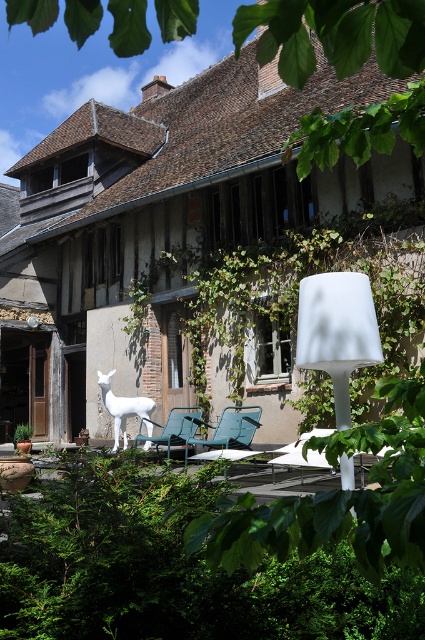
Question: Does white matte lamp at center appear under teal fabric chair at center?

Choices:
 (A) yes
 (B) no

Answer: (B)

Question: Which object is positioned farthest from the metallic blue chair at center?

Choices:
 (A) teal fabric chair at center
 (B) green leafy bush at lower left
 (C) white matte lamp at center
 (D) white glossy statue at center

Answer: (C)

Question: Which object is closer to the camera taking this photo?

Choices:
 (A) green leafy bush at lower left
 (B) white glossy statue at center
 (C) metallic blue chair at center
 (D) white matte lamp at center

Answer: (A)

Question: Is green leafy bush at lower left to the right of white matte lamp at center from the viewer's perspective?

Choices:
 (A) yes
 (B) no

Answer: (B)

Question: Which object is the farthest from the green leafy bush at lower left?

Choices:
 (A) metallic blue chair at center
 (B) white glossy statue at center
 (C) white matte lamp at center

Answer: (B)

Question: Is teal fabric chair at center smaller than white glossy statue at center?

Choices:
 (A) no
 (B) yes

Answer: (B)